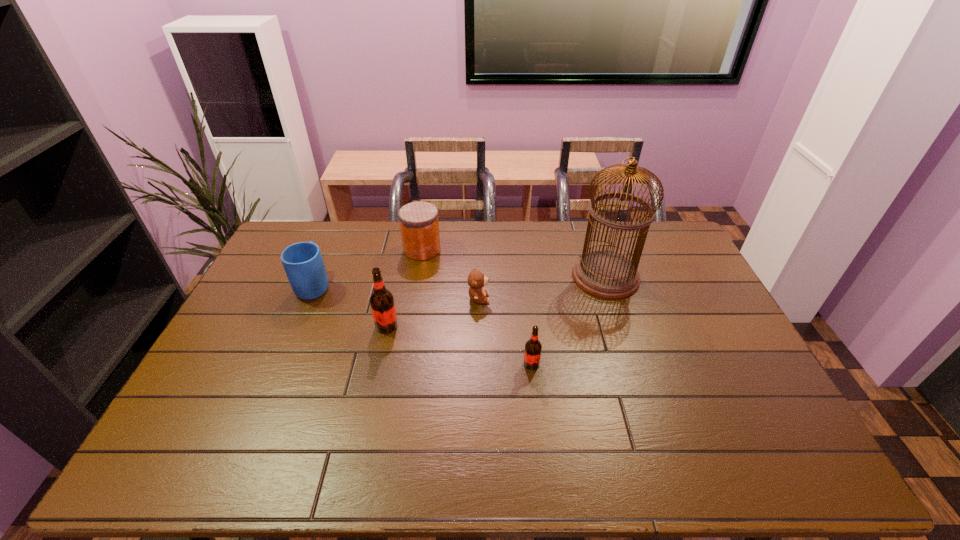
The width and height of the screenshot is (960, 540). I want to click on birdcage positioned at the far edge, so click(605, 274).

Identify the location of jar that is at the far edge. (419, 223).

Locate an element on the screen. The image size is (960, 540). object at the left edge is located at coordinates (303, 263).

In the image, there is a desktop. Identify the location of blank space at the far edge. (555, 242).

Identify the location of blank space at the near edge of the desktop. (270, 411).

You are a GUI agent. You are given a task and a screenshot of the screen. Output one action in this format:
    pyautogui.click(x=<x>, y=<y>)
    Task: Click on the free space at the left edge of the desktop
    The image size is (960, 540).
    Given the screenshot: What is the action you would take?
    pyautogui.click(x=291, y=292)

Locate an element on the screen. Image resolution: width=960 pixels, height=540 pixels. vacant space at the far left corner of the desktop is located at coordinates (299, 239).

In the image, there is a desktop. At what (x,y) coordinates should I click in order to perform the action: click on vacant space at the near right corner. Please return your answer as a coordinate pair (x, y). Looking at the image, I should click on (760, 406).

You are a GUI agent. You are given a task and a screenshot of the screen. Output one action in this format:
    pyautogui.click(x=<x>, y=<y>)
    Task: Click on the unoccupied position between the left root beer and the rightmost object
    This screenshot has width=960, height=540.
    Given the screenshot: What is the action you would take?
    pyautogui.click(x=496, y=301)

Image resolution: width=960 pixels, height=540 pixels. Identify the location of free area in between the nearer root beer and the jar. (477, 307).